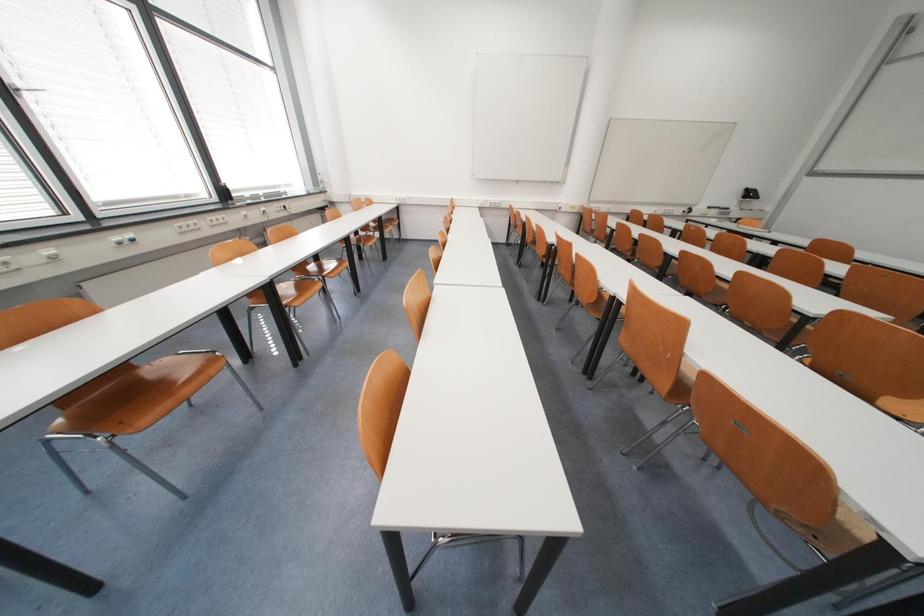
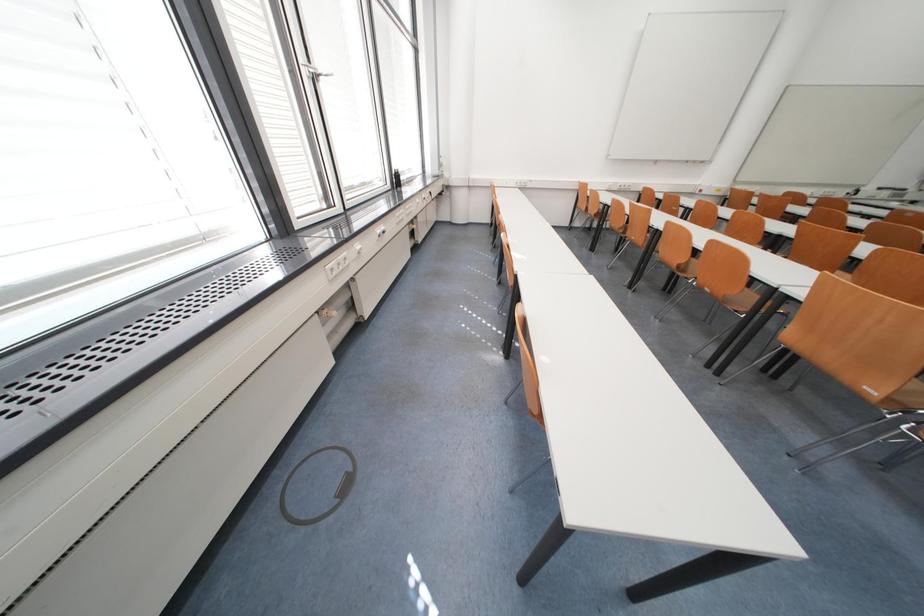
Question: The images are taken continuously from a first-person perspective. In which direction are you moving?

Choices:
 (A) Left
 (B) Right
 (C) Forward
 (D) Backward

Answer: (A)